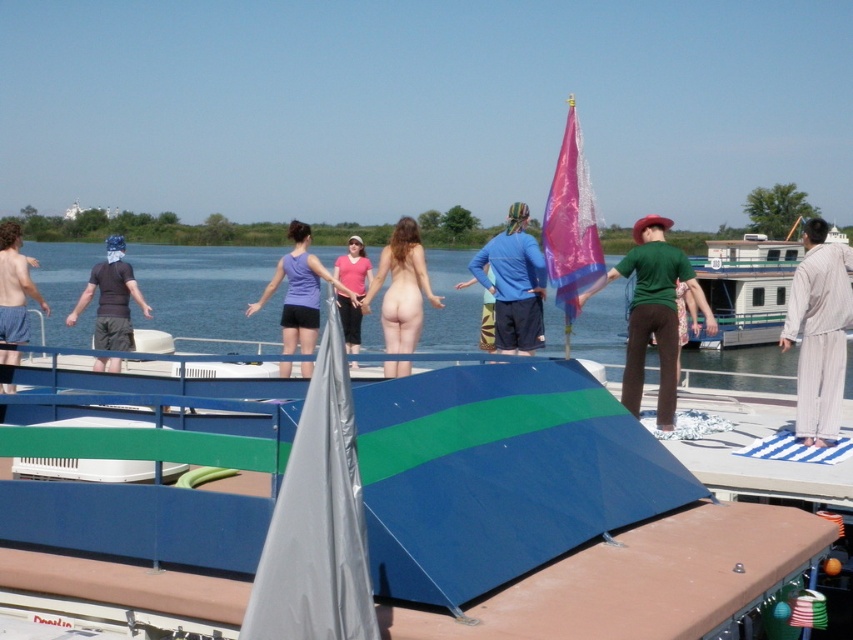
You are a photographer standing on the dock. You want to take a photo of the blue cotton shirt at center and the matte blue shorts at left. Which object is closer to you, the photographer?

The blue cotton shirt at center is closer to you because the matte blue shorts at left is behind it.

You are at the dock and want to find the person wearing the blue cotton shirt at center and the matte blue shorts at left. Which one is located to the right of the other?

The blue cotton shirt at center is positioned on the right side of matte blue shorts at left.

You are a photographer trying to capture a candid shot of the light beige robe at right and the matte blue shorts at left. Since you want to ensure both are clearly visible in the frame, which object should you focus on first to account for their sizes?

The light beige robe at right is smaller than the matte blue shorts at left. Therefore, you should focus on the matte blue shorts at left first because it is larger and will be easier to locate in the frame, ensuring both objects are captured clearly.